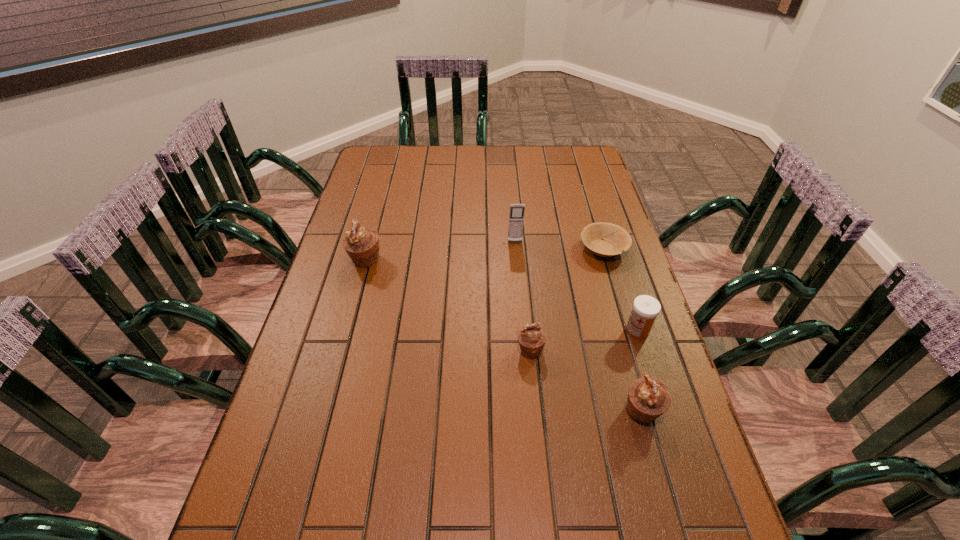
If the aim is uniform spacing by inserting an additional muffin among them, please point to a vacant space for this new muffin. Please provide its 2D coordinates. Your answer should be formatted as a tuple, i.e. [(x, y)], where the tuple contains the x and y coordinates of a point satisfying the conditions above.

[(441, 301)]